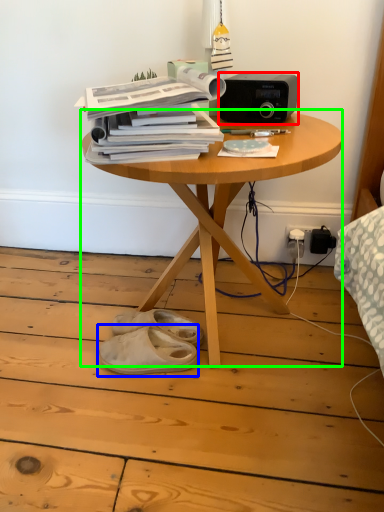
Question: Which is farther away from stereo (highlighted by a red box)? footwear (highlighted by a blue box) or table (highlighted by a green box)?

Choices:
 (A) footwear
 (B) table

Answer: (A)